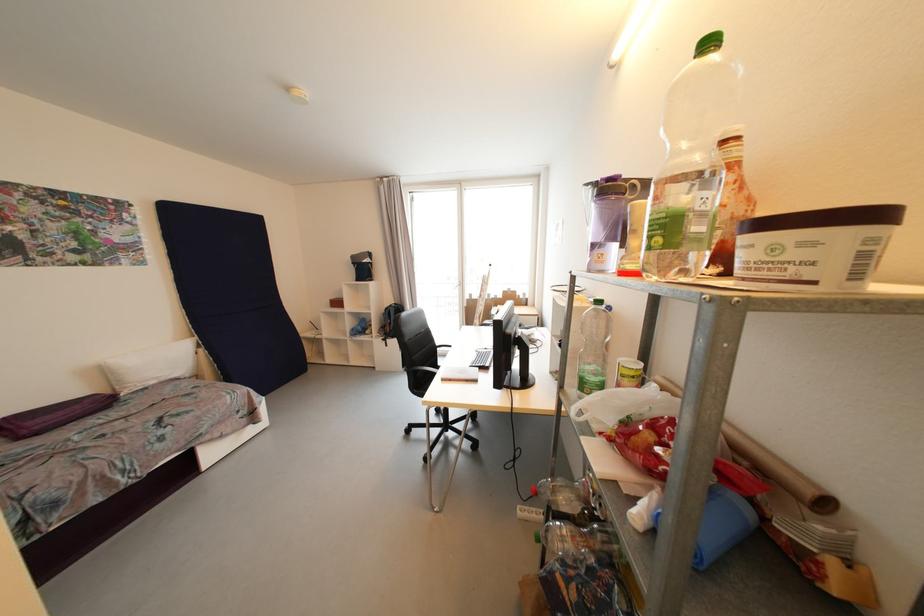
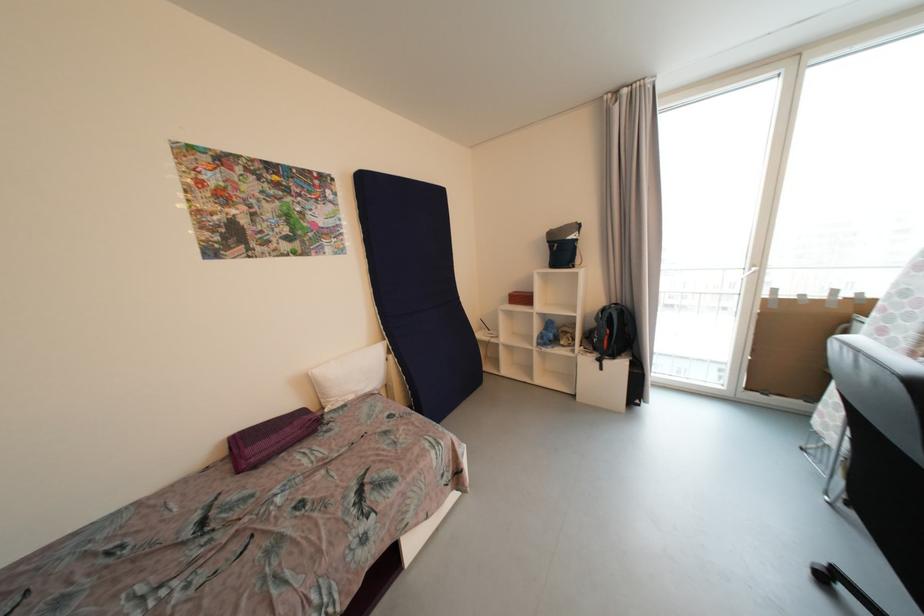
Locate, in the second image, the point that corresponds to [392,310] in the first image.

(608, 312)